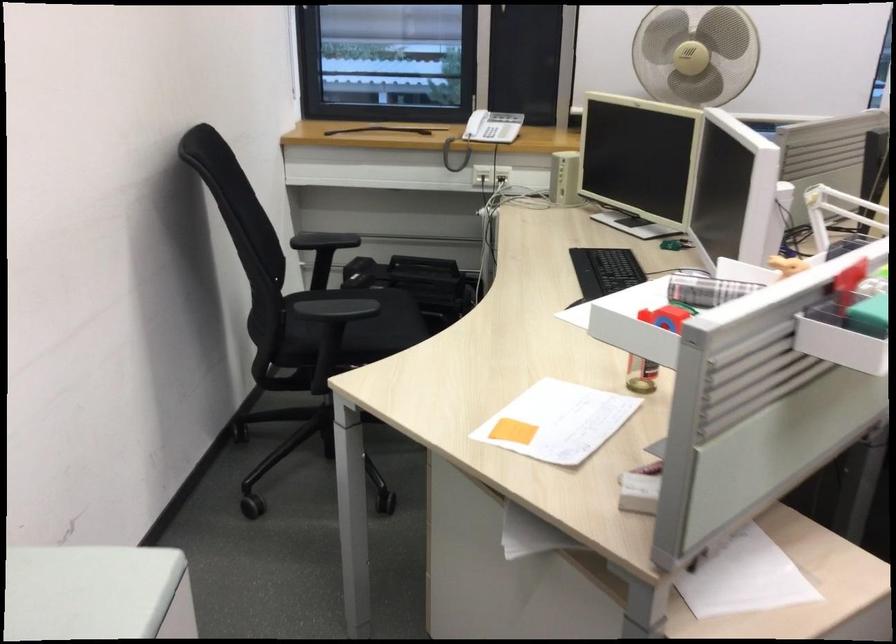
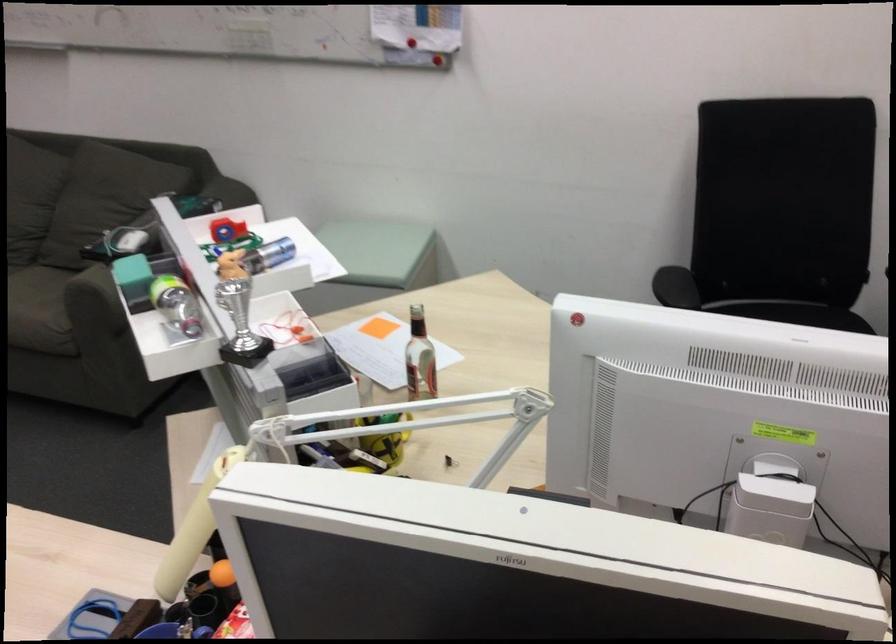
Where in the second image is the point corresponding to (606,355) from the first image?

(419, 359)